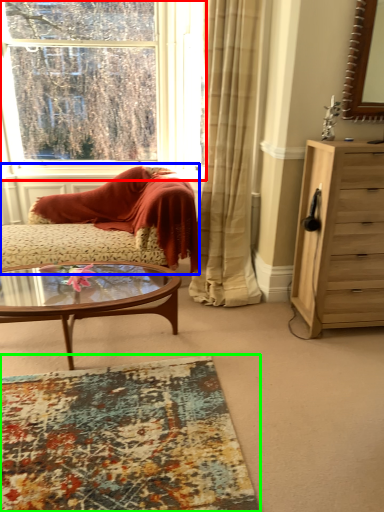
Question: Considering the real-world distances, which object is farthest from window (highlighted by a red box)? studio couch (highlighted by a blue box) or plain (highlighted by a green box)?

Choices:
 (A) studio couch
 (B) plain

Answer: (B)